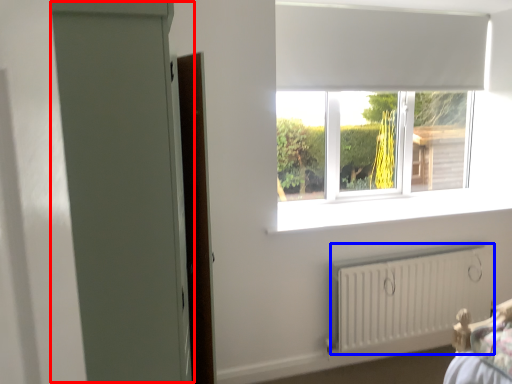
Question: Which object appears closest to the camera in this image, screen door (highlighted by a red box) or radiator (highlighted by a blue box)?

Choices:
 (A) screen door
 (B) radiator

Answer: (A)